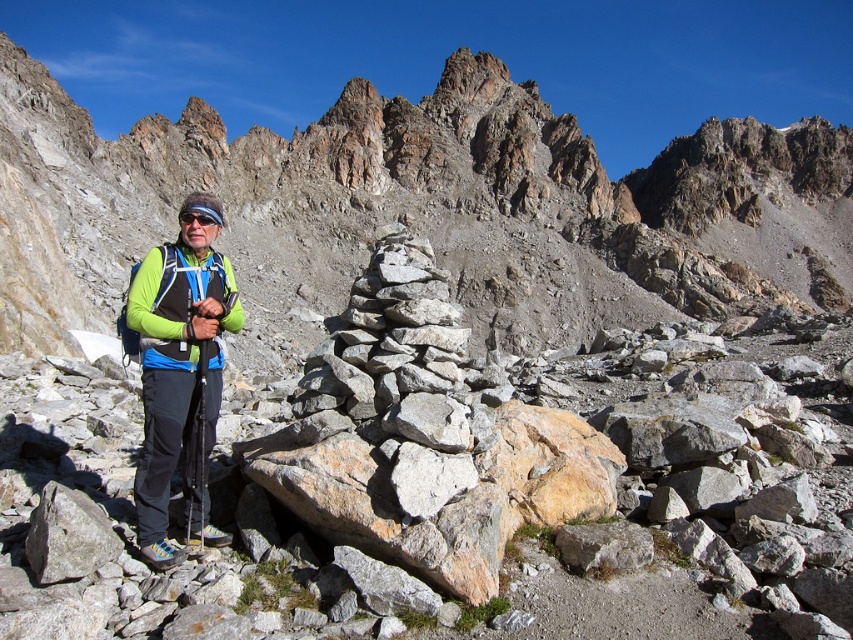
Question: Can you confirm if green matte jacket at left is smaller than black matte goggles at center?

Choices:
 (A) yes
 (B) no

Answer: (B)

Question: Among these points, which one is nearest to the camera?

Choices:
 (A) (196, 209)
 (B) (213, 310)

Answer: (B)

Question: Which object is closer to the camera taking this photo?

Choices:
 (A) green matte jacket at center
 (B) black matte goggles at center

Answer: (A)

Question: Which object is positioned farthest from the green matte jacket at center?

Choices:
 (A) black matte goggles at center
 (B) green matte jacket at left

Answer: (A)

Question: Is green matte jacket at left further to the viewer compared to black matte goggles at center?

Choices:
 (A) no
 (B) yes

Answer: (A)

Question: Considering the relative positions of green matte jacket at left and black matte goggles at center in the image provided, where is green matte jacket at left located with respect to black matte goggles at center?

Choices:
 (A) below
 (B) above

Answer: (A)